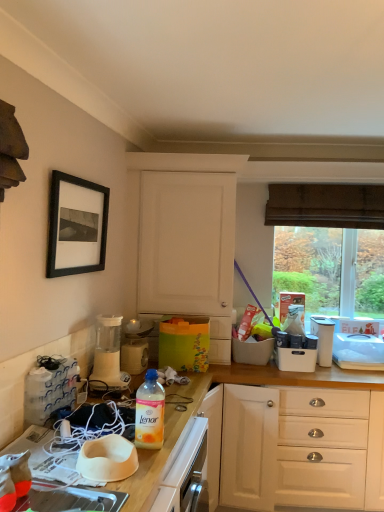
Question: Is transparent glass window at upper right positioned with its back to white matte cabinet at center?

Choices:
 (A) yes
 (B) no

Answer: (B)

Question: Is transparent glass window at upper right in front of white matte cabinet at center?

Choices:
 (A) yes
 (B) no

Answer: (B)

Question: Does transparent glass window at upper right have a greater height compared to white matte cabinet at center?

Choices:
 (A) no
 (B) yes

Answer: (A)

Question: From the image's perspective, does transparent glass window at upper right appear higher than white matte cabinet at center?

Choices:
 (A) no
 (B) yes

Answer: (A)

Question: From a real-world perspective, is transparent glass window at upper right positioned under white matte cabinet at center based on gravity?

Choices:
 (A) yes
 (B) no

Answer: (A)

Question: Is transparent glass window at upper right in front of or behind translucent plastic bottle at lower center in the image?

Choices:
 (A) behind
 (B) front

Answer: (A)

Question: Which is correct: transparent glass window at upper right is inside translucent plastic bottle at lower center, or outside of it?

Choices:
 (A) inside
 (B) outside

Answer: (B)

Question: From a real-world perspective, is transparent glass window at upper right above or below translucent plastic bottle at lower center?

Choices:
 (A) above
 (B) below

Answer: (A)

Question: In terms of height, does transparent glass window at upper right look taller or shorter compared to translucent plastic bottle at lower center?

Choices:
 (A) tall
 (B) short

Answer: (A)

Question: From their relative heights in the image, would you say white matte bowl at center is taller or shorter than white plastic container at upper right, the 4th appliance positioned from the front?

Choices:
 (A) short
 (B) tall

Answer: (A)

Question: In terms of size, does white matte bowl at center appear bigger or smaller than white plastic container at upper right, the 4th appliance positioned from the front?

Choices:
 (A) big
 (B) small

Answer: (B)

Question: Relative to white plastic container at upper right, which is the 1th appliance from back to front, is white matte bowl at center in front or behind?

Choices:
 (A) front
 (B) behind

Answer: (A)

Question: From the image's perspective, is white matte bowl at center above or below white plastic container at upper right, the 4th appliance positioned from the front?

Choices:
 (A) below
 (B) above

Answer: (A)

Question: In terms of height, does black matte picture frame at upper left look taller or shorter compared to translucent plastic bottle at lower center?

Choices:
 (A) short
 (B) tall

Answer: (B)

Question: From a real-world perspective, is black matte picture frame at upper left positioned above or below translucent plastic bottle at lower center?

Choices:
 (A) below
 (B) above

Answer: (B)